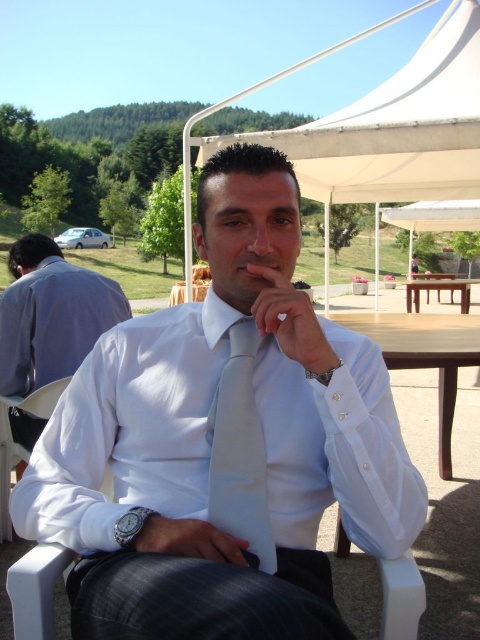
You are a photographer setting up a shoot at the picnic area. You need to position the light blue silk tie at center and the brown wooden picnic table at center in a way that the tie is visible in the frame. Based on their current positions, which object is closer to the left edge of the frame?

The light blue silk tie at center is positioned on the left side of the brown wooden picnic table at center, so it is closer to the left edge of the frame.

You are standing at the entrance of the park and want to locate the wooden table at center. According to the coordinates given, in which direction should you walk to reach it?

The wooden table at center is located at coordinates point (424, 355), so you should walk towards the direction where the coordinates increase in both x and y axes to reach it.

You are standing in the park and see two points marked in the image. The first point is at coordinates point (37, 320) and the second is at point (432, 321). Which point is closer to you?

Point (37, 320) is closer to the viewer than point (432, 321).